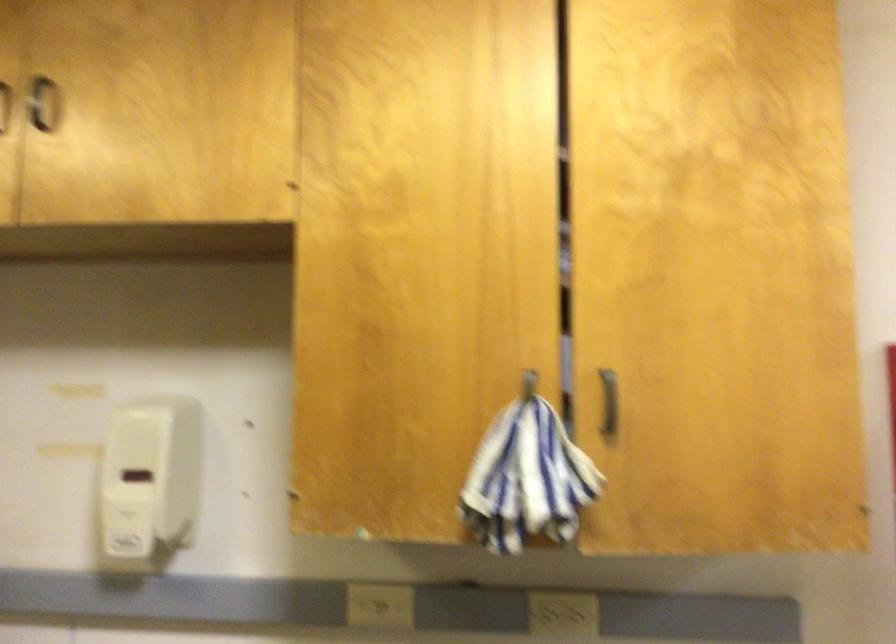
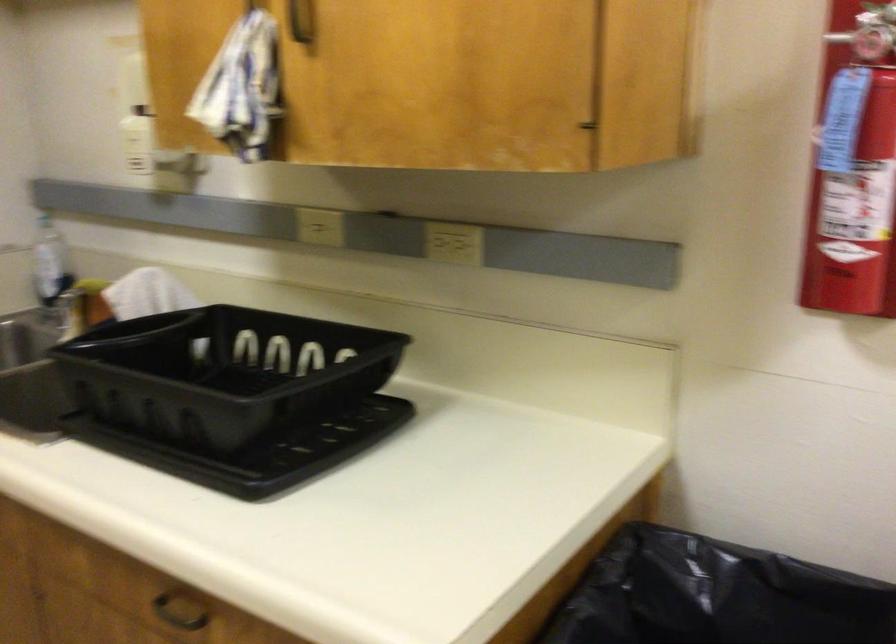
Find the pixel in the second image that matches the point at 521,404 in the first image.

(251, 6)